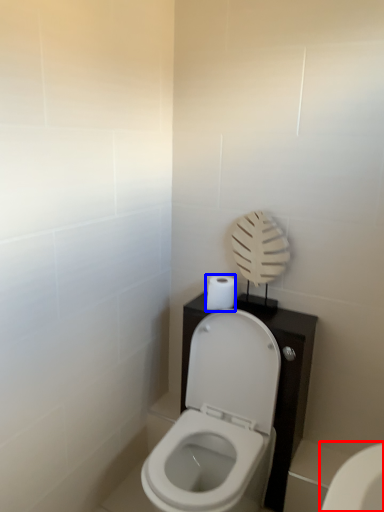
Question: Which point is closer to the camera, toilet (highlighted by a red box) or toilet paper (highlighted by a blue box)?

Choices:
 (A) toilet
 (B) toilet paper

Answer: (A)